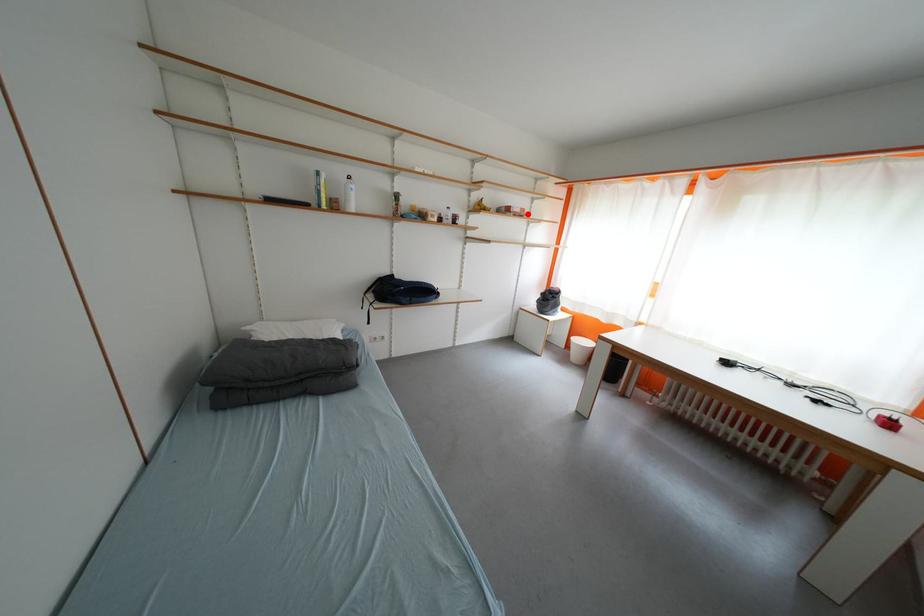
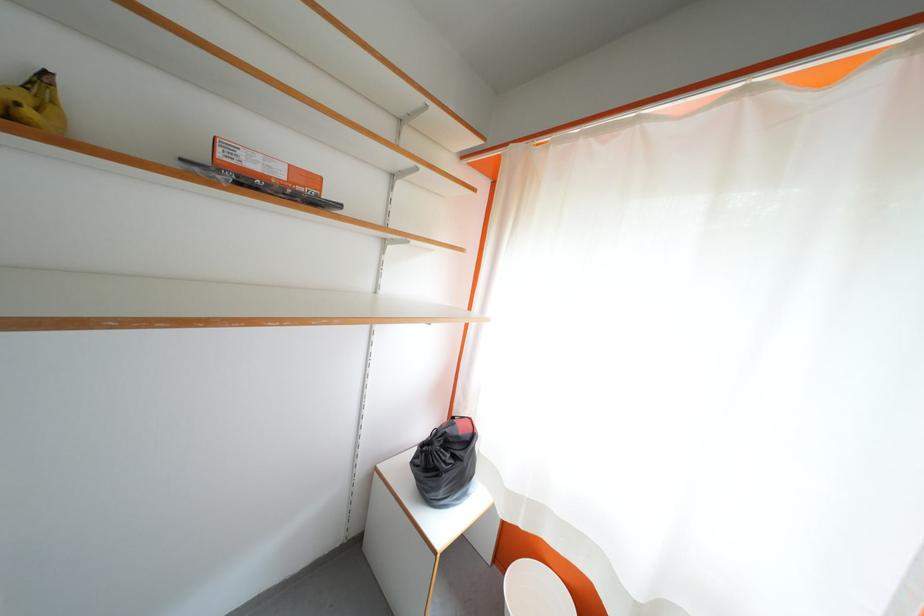
Question: A red point is marked in image1. In image2, is the corresponding 3D point closer to the camera or farther? Reply with the corresponding letter.

Choices:
 (A) The corresponding 3D point is closer.
 (B) The corresponding 3D point is farther.

Answer: (B)